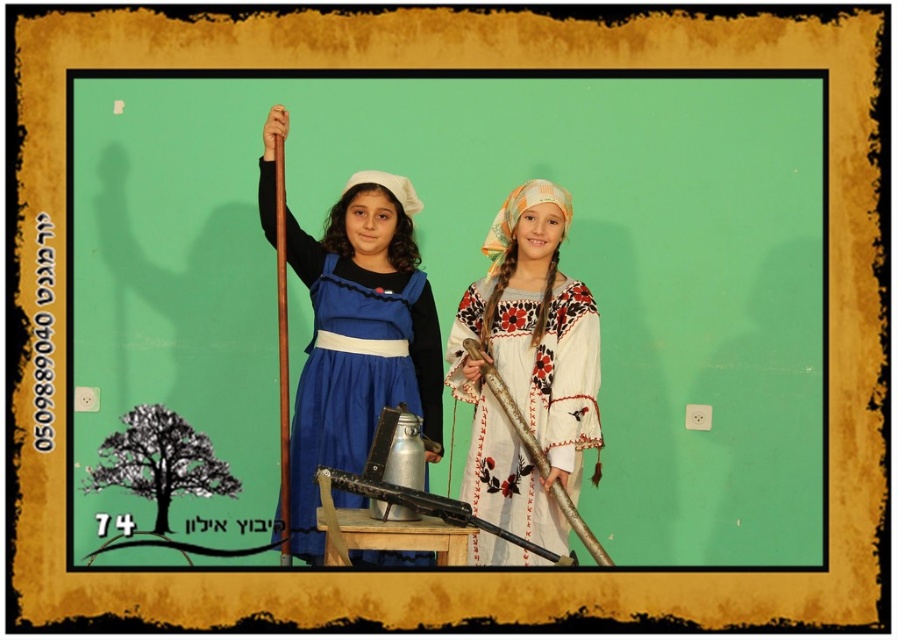
Question: Among these objects, which one is farthest from the camera?

Choices:
 (A) matte blue dress at center
 (B) white embroidered dress at center

Answer: (B)

Question: From the image, what is the correct spatial relationship of matte blue dress at center in relation to white embroidered dress at center?

Choices:
 (A) above
 (B) below

Answer: (A)

Question: Observing the image, what is the correct spatial positioning of matte blue dress at center in reference to white embroidered dress at center?

Choices:
 (A) below
 (B) above

Answer: (B)

Question: Is green matte wall at center closer to camera compared to matte blue dress at center?

Choices:
 (A) yes
 (B) no

Answer: (B)

Question: Which of the following is the farthest from the observer?

Choices:
 (A) (351, 227)
 (B) (580, 404)

Answer: (A)

Question: Which of the following is the farthest from the observer?

Choices:
 (A) green matte wall at center
 (B) white embroidered dress at center

Answer: (A)